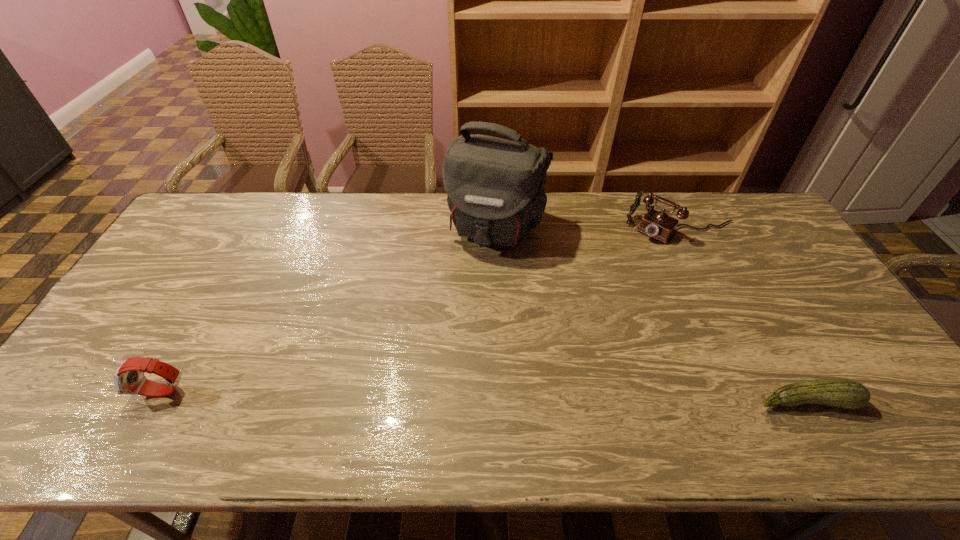
Find the location of a particular element. Image resolution: width=960 pixels, height=540 pixels. vacant space that is in between the shortest object and the watch is located at coordinates (485, 396).

Locate an element on the screen. The height and width of the screenshot is (540, 960). free space between the shoulder bag and the shortest object is located at coordinates (652, 315).

Locate an element on the screen. The height and width of the screenshot is (540, 960). vacant space that is in between the telephone and the shortest object is located at coordinates (744, 315).

The image size is (960, 540). Identify the location of free area in between the shoulder bag and the telephone. (589, 229).

Locate an element on the screen. This screenshot has height=540, width=960. free space between the shortest object and the leftmost object is located at coordinates (485, 396).

Locate an element on the screen. The image size is (960, 540). vacant space that's between the watch and the telephone is located at coordinates (422, 310).

Find the location of a particular element. The width and height of the screenshot is (960, 540). object that ranks as the third closest to the zucchini is located at coordinates (129, 378).

Where is `object that stands as the closest to the zucchini`? The width and height of the screenshot is (960, 540). object that stands as the closest to the zucchini is located at coordinates (657, 224).